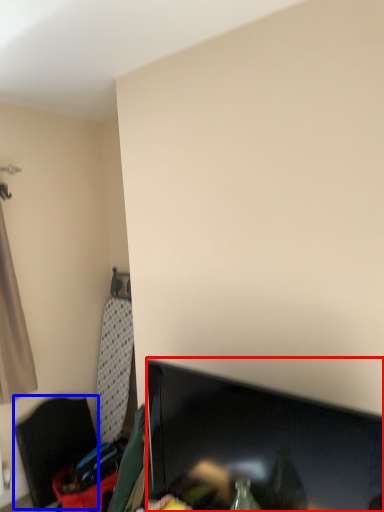
Question: Which object appears farthest to the camera in this image, television (highlighted by a red box) or furniture (highlighted by a blue box)?

Choices:
 (A) television
 (B) furniture

Answer: (B)